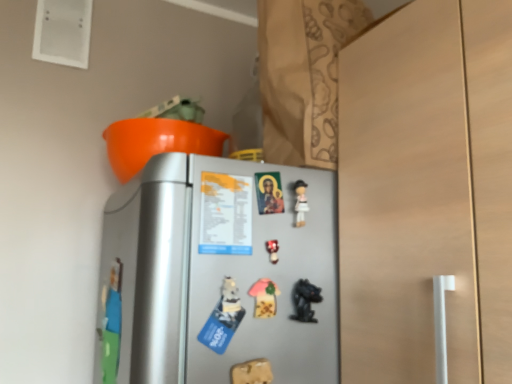
How much space does black glossy figurine at lower center, the 3th toy when ordered from top to bottom, occupy vertically?

It is 3.14 inches.

What do you see at coordinates (305, 300) in the screenshot?
I see `black glossy figurine at lower center, positioned as the second toy in bottom-to-top order` at bounding box center [305, 300].

How much space does pink fabric mushroom at center, acting as the 3th toy starting from the bottom, occupy vertically?

pink fabric mushroom at center, acting as the 3th toy starting from the bottom, is 2.92 inches in height.

I want to click on wooden toy at lower center, which is the 4th toy from top to bottom, so [x=252, y=372].

Find the location of `silver metallic refrigerator at center`. silver metallic refrigerator at center is located at coordinates (215, 272).

Between wooden toy at lower center, which is the 4th toy from top to bottom, and matte plastic toy at center, which is the first toy in top-to-bottom order, which one has larger width?

matte plastic toy at center, which is the first toy in top-to-bottom order, is wider.

How distant is wooden toy at lower center, which is the 1th toy in bottom-to-top order, from matte plastic toy at center, which is the fourth toy from bottom to top?

wooden toy at lower center, which is the 1th toy in bottom-to-top order, and matte plastic toy at center, which is the fourth toy from bottom to top, are 7.64 inches apart.

In the scene shown: From a real-world perspective, is wooden toy at lower center, which is the 1th toy in bottom-to-top order, above or below matte plastic toy at center, which is the first toy in top-to-bottom order?

wooden toy at lower center, which is the 1th toy in bottom-to-top order, is below matte plastic toy at center, which is the first toy in top-to-bottom order.

Is point (234, 376) behind point (275, 246)?

No, it is in front of (275, 246).

Does point (293, 300) appear closer or farther from the camera than point (268, 243)?

Point (293, 300) appears to be farther away from the viewer than point (268, 243).

Is black glossy figurine at lower center, positioned as the second toy in bottom-to-top order, located outside matte plastic toy at center, which is the fourth toy from bottom to top?

Yes, black glossy figurine at lower center, positioned as the second toy in bottom-to-top order, is outside of matte plastic toy at center, which is the fourth toy from bottom to top.

Considering the relative positions of black glossy figurine at lower center, positioned as the second toy in bottom-to-top order, and matte plastic toy at center, which is the first toy in top-to-bottom order, in the image provided, is black glossy figurine at lower center, positioned as the second toy in bottom-to-top order, to the left or to the right of matte plastic toy at center, which is the first toy in top-to-bottom order,?

black glossy figurine at lower center, positioned as the second toy in bottom-to-top order, is positioned on matte plastic toy at center, which is the first toy in top-to-bottom order,'s right side.

Looking at the image, does black glossy figurine at lower center, the 3th toy when ordered from top to bottom, seem bigger or smaller compared to pink fabric mushroom at center, the 2th toy in the top-to-bottom sequence?

In the image, black glossy figurine at lower center, the 3th toy when ordered from top to bottom, appears to be larger than pink fabric mushroom at center, the 2th toy in the top-to-bottom sequence.

Is pink fabric mushroom at center, acting as the 3th toy starting from the bottom, at the back of black glossy figurine at lower center, the 3th toy when ordered from top to bottom?

black glossy figurine at lower center, the 3th toy when ordered from top to bottom, does not have its back to pink fabric mushroom at center, acting as the 3th toy starting from the bottom.

Is black glossy figurine at lower center, positioned as the second toy in bottom-to-top order, thinner than pink fabric mushroom at center, acting as the 3th toy starting from the bottom?

No.

Is pink fabric mushroom at center, acting as the 3th toy starting from the bottom, wider or thinner than wooden toy at lower center, which is the 4th toy from top to bottom?

In the image, pink fabric mushroom at center, acting as the 3th toy starting from the bottom, appears to be wider than wooden toy at lower center, which is the 4th toy from top to bottom.

Visually, is pink fabric mushroom at center, acting as the 3th toy starting from the bottom, positioned to the left or to the right of wooden toy at lower center, which is the 1th toy in bottom-to-top order?

From the image, it's evident that pink fabric mushroom at center, acting as the 3th toy starting from the bottom, is to the right of wooden toy at lower center, which is the 1th toy in bottom-to-top order.

In terms of size, does pink fabric mushroom at center, the 2th toy in the top-to-bottom sequence, appear bigger or smaller than wooden toy at lower center, which is the 1th toy in bottom-to-top order?

pink fabric mushroom at center, the 2th toy in the top-to-bottom sequence, is bigger than wooden toy at lower center, which is the 1th toy in bottom-to-top order.

Which is less distant, (273, 302) or (264, 370)?

The point (264, 370) is in front.

There is a silver metallic refrigerator at center. Where is `toy above it (from a real-world perspective)`? This screenshot has height=384, width=512. toy above it (from a real-world perspective) is located at coordinates (272, 250).

Based on their positions, is matte plastic toy at center, which is the fourth toy from bottom to top, located to the left or right of silver metallic refrigerator at center?

matte plastic toy at center, which is the fourth toy from bottom to top, is to the right of silver metallic refrigerator at center.

Does matte plastic toy at center, which is the first toy in top-to-bottom order, have a larger size compared to silver metallic refrigerator at center?

Incorrect, matte plastic toy at center, which is the first toy in top-to-bottom order, is not larger than silver metallic refrigerator at center.

In the image, is silver metallic refrigerator at center positioned in front of or behind wooden toy at lower center, which is the 4th toy from top to bottom?

silver metallic refrigerator at center is in front of wooden toy at lower center, which is the 4th toy from top to bottom.

From the image's perspective, which one is positioned lower, silver metallic refrigerator at center or wooden toy at lower center, which is the 4th toy from top to bottom?

wooden toy at lower center, which is the 4th toy from top to bottom.

Which is less distant, (278, 277) or (268, 381)?

Point (278, 277).

From the image's perspective, is pink fabric mushroom at center, the 2th toy in the top-to-bottom sequence, located beneath black glossy figurine at lower center, positioned as the second toy in bottom-to-top order?

Actually, pink fabric mushroom at center, the 2th toy in the top-to-bottom sequence, appears above black glossy figurine at lower center, positioned as the second toy in bottom-to-top order, in the image.

From a real-world perspective, which toy is the 1st one underneath the pink fabric mushroom at center, the 2th toy in the top-to-bottom sequence? Please provide its 2D coordinates.

[(305, 300)]

Is pink fabric mushroom at center, the 2th toy in the top-to-bottom sequence, aimed at black glossy figurine at lower center, the 3th toy when ordered from top to bottom?

No, pink fabric mushroom at center, the 2th toy in the top-to-bottom sequence, is not aimed at black glossy figurine at lower center, the 3th toy when ordered from top to bottom.

Is pink fabric mushroom at center, acting as the 3th toy starting from the bottom, not close to black glossy figurine at lower center, the 3th toy when ordered from top to bottom?

That's not correct — pink fabric mushroom at center, acting as the 3th toy starting from the bottom, is a little close to black glossy figurine at lower center, the 3th toy when ordered from top to bottom.

Locate an element on the screen. the 3rd toy above when counting from the wooden toy at lower center, which is the 4th toy from top to bottom (from the image's perspective) is located at coordinates [x=272, y=250].

Where is `toy on the right side of matte plastic toy at center, which is the first toy in top-to-bottom order`? toy on the right side of matte plastic toy at center, which is the first toy in top-to-bottom order is located at coordinates (305, 300).

Estimate the real-world distances between objects in this image. Which object is closer to silver metallic refrigerator at center, matte plastic toy at center, which is the fourth toy from bottom to top, or black glossy figurine at lower center, the 3th toy when ordered from top to bottom?

matte plastic toy at center, which is the fourth toy from bottom to top.

Based on their spatial positions, is matte plastic toy at center, which is the fourth toy from bottom to top, or silver metallic refrigerator at center further from black glossy figurine at lower center, positioned as the second toy in bottom-to-top order?

silver metallic refrigerator at center is positioned further to the anchor black glossy figurine at lower center, positioned as the second toy in bottom-to-top order.

When comparing their distances from pink fabric mushroom at center, the 2th toy in the top-to-bottom sequence, does matte plastic toy at center, which is the fourth toy from bottom to top, or silver metallic refrigerator at center seem further?

The object further to pink fabric mushroom at center, the 2th toy in the top-to-bottom sequence, is silver metallic refrigerator at center.

Based on their spatial positions, is black glossy figurine at lower center, positioned as the second toy in bottom-to-top order, or silver metallic refrigerator at center closer to matte plastic toy at center, which is the fourth toy from bottom to top?

Among the two, black glossy figurine at lower center, positioned as the second toy in bottom-to-top order, is located nearer to matte plastic toy at center, which is the fourth toy from bottom to top.

Based on their spatial positions, is black glossy figurine at lower center, positioned as the second toy in bottom-to-top order, or wooden toy at lower center, which is the 4th toy from top to bottom, further from pink fabric mushroom at center, acting as the 3th toy starting from the bottom?

wooden toy at lower center, which is the 4th toy from top to bottom, is positioned further to the anchor pink fabric mushroom at center, acting as the 3th toy starting from the bottom.

Considering their positions, is silver metallic refrigerator at center positioned further to wooden toy at lower center, which is the 1th toy in bottom-to-top order, than black glossy figurine at lower center, positioned as the second toy in bottom-to-top order?

silver metallic refrigerator at center is positioned further to the anchor wooden toy at lower center, which is the 1th toy in bottom-to-top order.

Estimate the real-world distances between objects in this image. Which object is further from black glossy figurine at lower center, the 3th toy when ordered from top to bottom, matte plastic toy at center, which is the fourth toy from bottom to top, or pink fabric mushroom at center, acting as the 3th toy starting from the bottom?

matte plastic toy at center, which is the fourth toy from bottom to top, lies further to black glossy figurine at lower center, the 3th toy when ordered from top to bottom, than the other object.

Based on the photo, considering their positions, is wooden toy at lower center, which is the 1th toy in bottom-to-top order, positioned closer to black glossy figurine at lower center, the 3th toy when ordered from top to bottom, than pink fabric mushroom at center, the 2th toy in the top-to-bottom sequence?

pink fabric mushroom at center, the 2th toy in the top-to-bottom sequence, lies closer to black glossy figurine at lower center, the 3th toy when ordered from top to bottom, than the other object.

Locate an element on the screen. The image size is (512, 384). refrigerator between pink fabric mushroom at center, the 2th toy in the top-to-bottom sequence, and black glossy figurine at lower center, positioned as the second toy in bottom-to-top order is located at coordinates (215, 272).

Locate an element on the screen. toy between matte plastic toy at center, which is the fourth toy from bottom to top, and black glossy figurine at lower center, the 3th toy when ordered from top to bottom, vertically is located at coordinates (264, 298).

In order to click on refrigerator between matte plastic toy at center, which is the first toy in top-to-bottom order, and wooden toy at lower center, which is the 4th toy from top to bottom, in the up-down direction in this screenshot , I will do `click(215, 272)`.

Find the location of `toy that lies between pink fabric mushroom at center, the 2th toy in the top-to-bottom sequence, and wooden toy at lower center, which is the 1th toy in bottom-to-top order, from top to bottom`. toy that lies between pink fabric mushroom at center, the 2th toy in the top-to-bottom sequence, and wooden toy at lower center, which is the 1th toy in bottom-to-top order, from top to bottom is located at coordinates (305, 300).